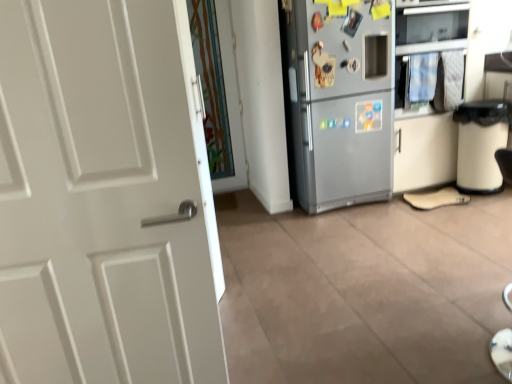
Question: Is transparent glass door at center facing away from satin silver oven at upper right?

Choices:
 (A) no
 (B) yes

Answer: (A)

Question: Is transparent glass door at center further to the viewer compared to satin silver oven at upper right?

Choices:
 (A) yes
 (B) no

Answer: (A)

Question: Can you confirm if transparent glass door at center is wider than satin silver oven at upper right?

Choices:
 (A) no
 (B) yes

Answer: (A)

Question: Can you confirm if transparent glass door at center is positioned to the left of satin silver oven at upper right?

Choices:
 (A) no
 (B) yes

Answer: (B)

Question: Could satin silver oven at upper right be considered to be inside transparent glass door at center?

Choices:
 (A) yes
 (B) no

Answer: (B)

Question: Is white plastic trash bin at right spatially inside satin silver oven at upper right, or outside of it?

Choices:
 (A) outside
 (B) inside

Answer: (A)

Question: In terms of height, does white plastic trash bin at right look taller or shorter compared to satin silver oven at upper right?

Choices:
 (A) short
 (B) tall

Answer: (A)

Question: From the image's perspective, relative to satin silver oven at upper right, is white plastic trash bin at right above or below?

Choices:
 (A) below
 (B) above

Answer: (A)

Question: From a real-world perspective, relative to satin silver oven at upper right, is white plastic trash bin at right vertically above or below?

Choices:
 (A) above
 (B) below

Answer: (B)

Question: From a real-world perspective, is white plastic trash bin at right above or below beige suede shoe at lower right?

Choices:
 (A) above
 (B) below

Answer: (A)

Question: Is white plastic trash bin at right inside or outside of beige suede shoe at lower right?

Choices:
 (A) outside
 (B) inside

Answer: (A)

Question: From their relative heights in the image, would you say white plastic trash bin at right is taller or shorter than beige suede shoe at lower right?

Choices:
 (A) tall
 (B) short

Answer: (A)

Question: In the image, is white plastic trash bin at right positioned in front of or behind beige suede shoe at lower right?

Choices:
 (A) front
 (B) behind

Answer: (A)

Question: Considering the positions of transparent glass door at center and satin silver oven at upper right in the image, is transparent glass door at center taller or shorter than satin silver oven at upper right?

Choices:
 (A) tall
 (B) short

Answer: (A)

Question: Considering their positions, is transparent glass door at center located in front of or behind satin silver oven at upper right?

Choices:
 (A) behind
 (B) front

Answer: (A)